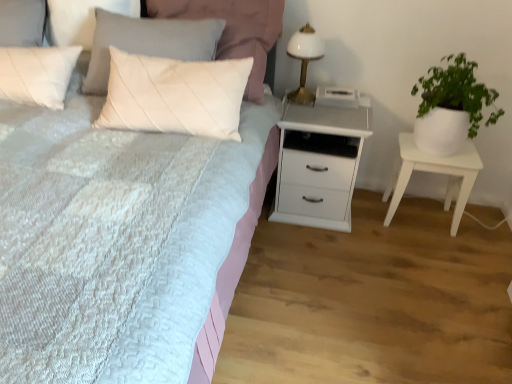
Locate an element on the screen. This screenshot has height=384, width=512. unoccupied region to the right of white matte nightstand at right is located at coordinates pyautogui.click(x=484, y=227).